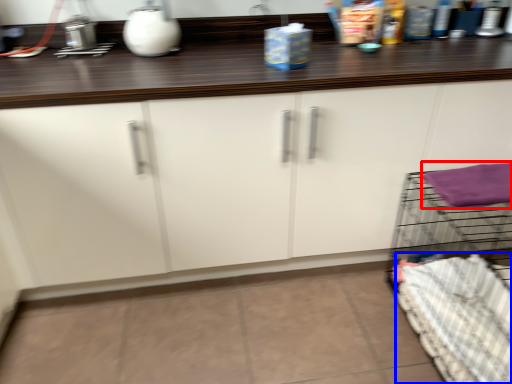
Question: Which object is closer to the camera taking this photo, bath towel (highlighted by a red box) or bedding (highlighted by a blue box)?

Choices:
 (A) bath towel
 (B) bedding

Answer: (B)